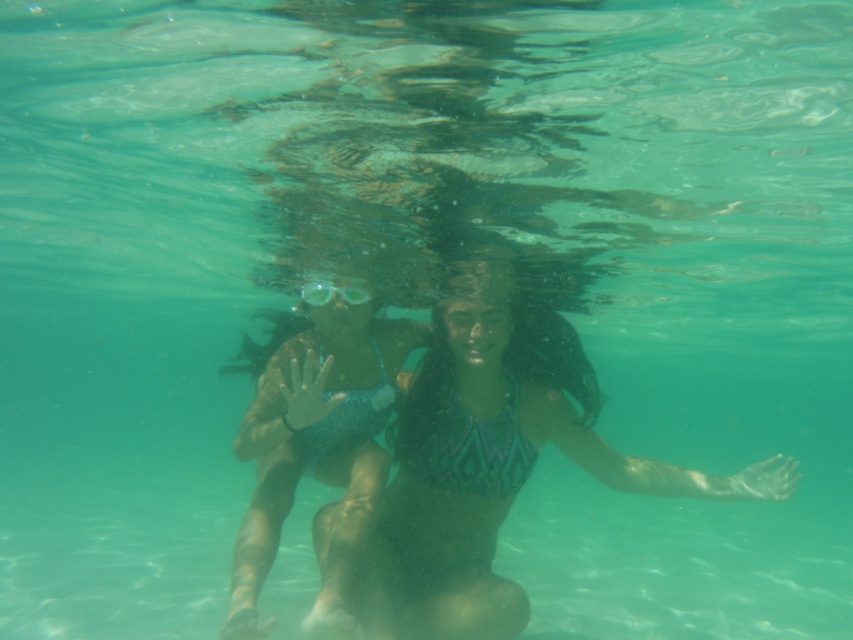
Between teal fabric bikini at center and clear plastic goggles at center, which one appears on the left side from the viewer's perspective?

clear plastic goggles at center

Between teal fabric bikini at center and clear plastic goggles at center, which one is positioned lower?

Positioned lower is teal fabric bikini at center.

Is point (418, 500) in front of point (328, 296)?

No, it is behind (328, 296).

At what (x,y) coordinates should I click in order to perform the action: click on teal fabric bikini at center. Please return your answer as a coordinate pair (x, y). Looking at the image, I should click on (494, 461).

Is teal textured bikini at center wider than clear plastic goggles at center?

In fact, teal textured bikini at center might be narrower than clear plastic goggles at center.

Between point (341, 436) and point (337, 289), which one is positioned behind?

The point (337, 289) is behind.

Identify the location of teal textured bikini at center. (347, 420).

At what (x,y) coordinates should I click in order to perform the action: click on teal textured bikini at center. Please return your answer as a coordinate pair (x, y). Looking at the image, I should click on (347, 420).

Between green textured bikini top at center and clear plastic goggles at center, which one appears on the right side from the viewer's perspective?

Positioned to the right is green textured bikini top at center.

Describe the element at coordinates (462, 444) in the screenshot. I see `green textured bikini top at center` at that location.

Identify the location of green textured bikini top at center. (462, 444).